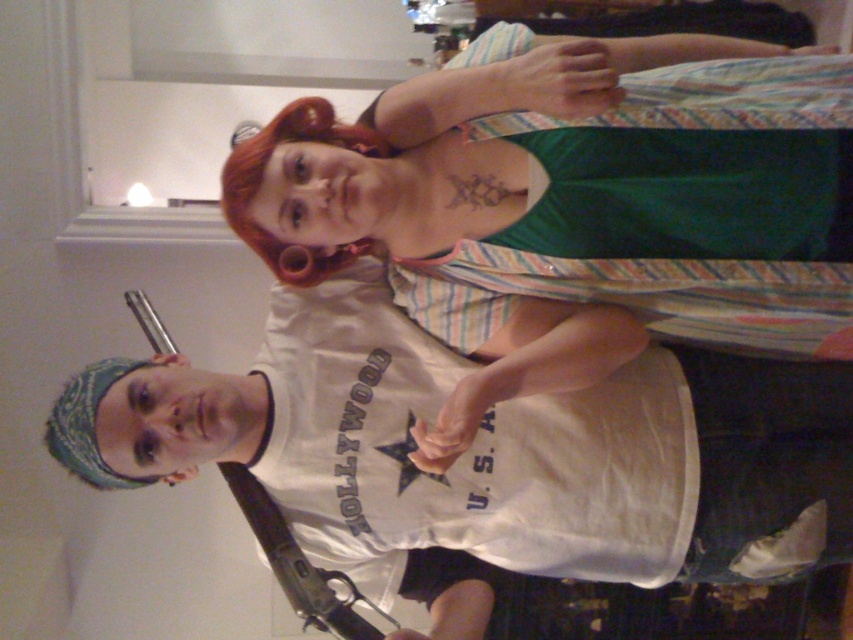
Which is more to the right, white cotton shirt at center or white cotton t-shirt at center?

Positioned to the right is white cotton shirt at center.

Where is `white cotton shirt at center`? The height and width of the screenshot is (640, 853). white cotton shirt at center is located at coordinates (573, 205).